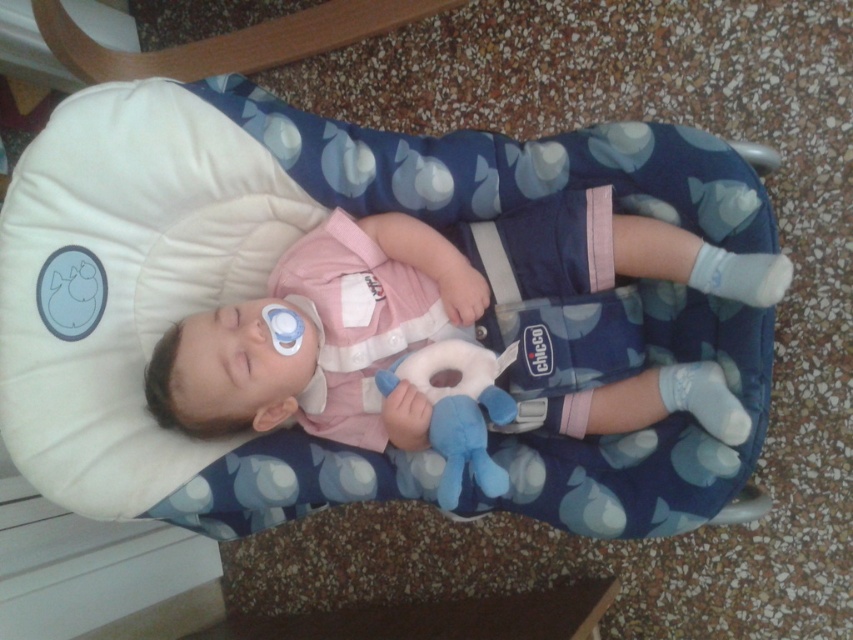
Question: Which object is closer to the camera taking this photo?

Choices:
 (A) soft plush toy at center
 (B) pink fabric baby at center

Answer: (B)

Question: Is pink fabric baby at center bigger than soft plush toy at center?

Choices:
 (A) yes
 (B) no

Answer: (A)

Question: Which object appears farthest from the camera in this image?

Choices:
 (A) soft plush toy at center
 (B) pink fabric baby at center

Answer: (A)

Question: Is blue fabric infant bed at center smaller than pink fabric baby at center?

Choices:
 (A) no
 (B) yes

Answer: (A)

Question: Which point is farther from the camera taking this photo?

Choices:
 (A) (569, 330)
 (B) (448, 396)
 (C) (648, 244)

Answer: (A)

Question: Can you confirm if pink fabric baby at center is wider than soft plush toy at center?

Choices:
 (A) yes
 (B) no

Answer: (A)